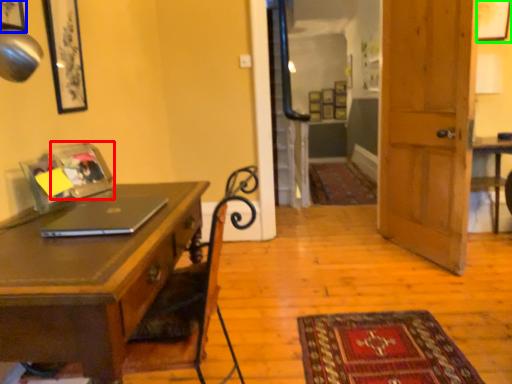
Question: Which is farther away from picture frame (highlighted by a red box)? picture frame (highlighted by a blue box) or picture frame (highlighted by a green box)?

Choices:
 (A) picture frame
 (B) picture frame

Answer: (B)